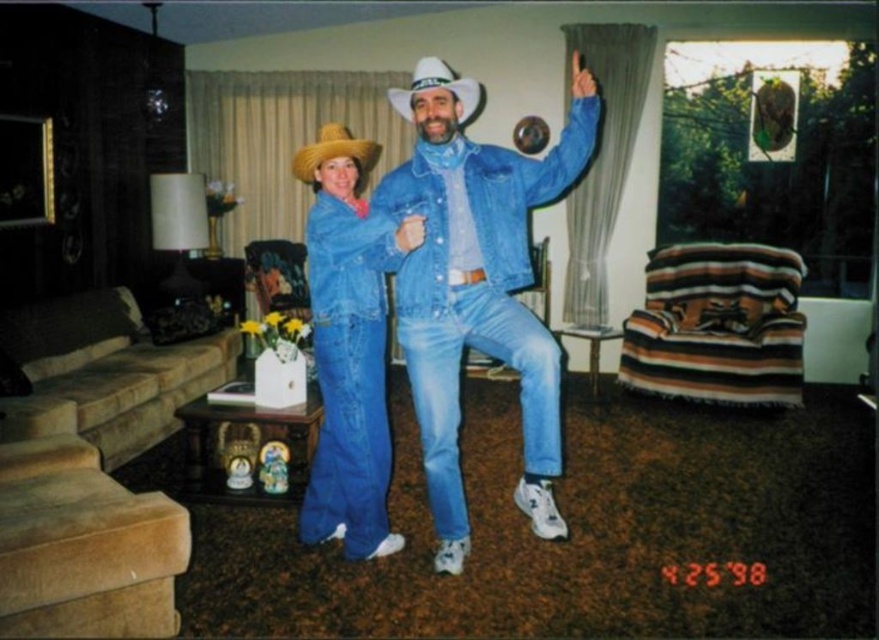
You are standing in the living room and see the denim blue jeans at center and the natural straw cowboy hat at center. Which object is positioned more to the right?

The denim blue jeans at center is positioned to the right of the natural straw cowboy hat at center, so the denim blue jeans at center is more to the right.

What is located at the coordinates point (478, 294) in the image?

The coordinates point (478, 294) marks denim blue jeans at center.

You are designing a storage space for clothing items. You have a shelf that can only accommodate items up to 30 cm in width. You need to place both the denim blue jeans at center and the denim jacket at center on the same shelf. Can both items fit side by side without exceeding the shelf width?

The denim blue jeans at center is wider than the denim jacket at center. If the jeans are 30 cm or less in width, both can fit. However, if the jeans exceed 30 cm, they won